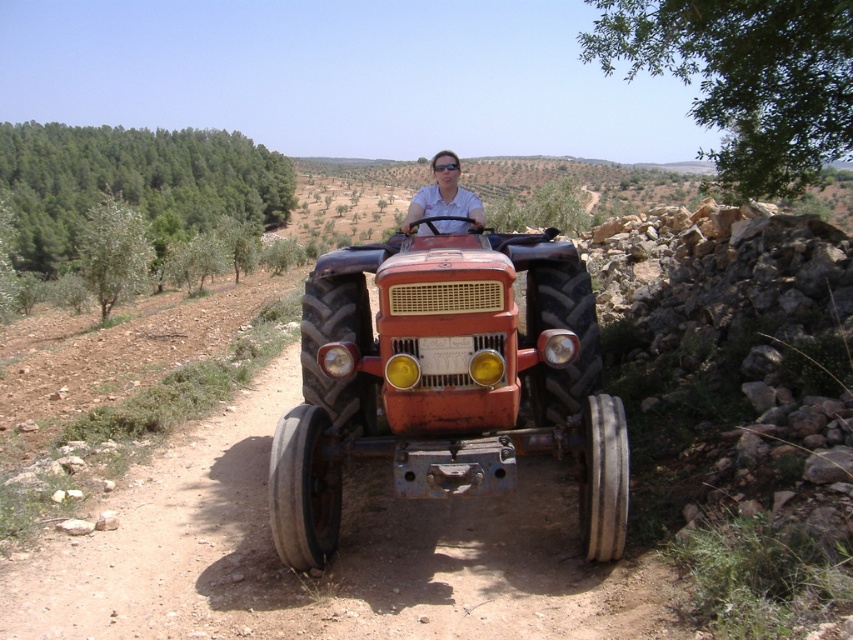
You are standing next to the dirt track at center and want to place a small box on top of the rustic metal tractor at center. Based on the scene description, will the box be visible from the ground level when placed there?

The dirt track at center has a lesser height compared to rustic metal tractor at center. Since the tractor is taller than the track, placing the box on top of the rustic metal tractor at center would make it visible from the ground level as long as there are no obstructions.

You are a photographer trying to capture the matte white shirt at center and the dirt track at center in a single shot. Based on their sizes in the image, which object should you focus on first to ensure both are in frame?

The dirt track at center has a smaller size compared to matte white shirt at center, so you should focus on the matte white shirt at center first to ensure both are in frame.

What is the 2D coordinate of the dirt track at center?

The dirt track at center is located at the 2D coordinate point of [332,557].